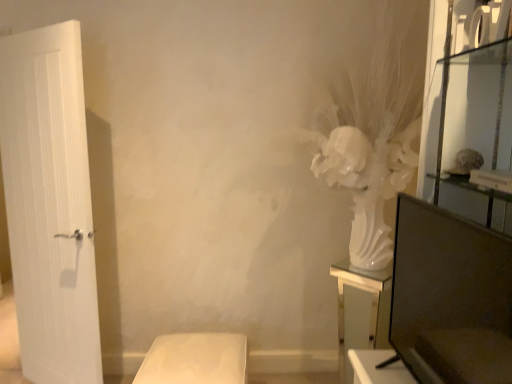
Question: Is white matte stool at lower center, the second furniture positioned from the right, in front of or behind white glossy vase at right, which is counted as the 2th furniture, starting from the left, in the image?

Choices:
 (A) front
 (B) behind

Answer: (A)

Question: From a real-world perspective, is white matte stool at lower center, the second furniture positioned from the right, physically located above or below white glossy vase at right, which is counted as the 2th furniture, starting from the left?

Choices:
 (A) below
 (B) above

Answer: (A)

Question: Is point [183, 350] closer or farther from the camera than point [368, 314]?

Choices:
 (A) farther
 (B) closer

Answer: (B)

Question: From the image's perspective, is white glossy vase at right, which is counted as the 2th furniture, starting from the left, above or below white matte stool at lower center, the 1th furniture in the left-to-right sequence?

Choices:
 (A) below
 (B) above

Answer: (B)

Question: Would you say white glossy vase at right, the first furniture in the right-to-left sequence, is to the left or to the right of white matte stool at lower center, the second furniture positioned from the right, in the picture?

Choices:
 (A) left
 (B) right

Answer: (B)

Question: Considering the positions of white glossy vase at right, the first furniture in the right-to-left sequence, and white matte stool at lower center, the second furniture positioned from the right, in the image, is white glossy vase at right, the first furniture in the right-to-left sequence, wider or thinner than white matte stool at lower center, the second furniture positioned from the right,?

Choices:
 (A) thin
 (B) wide

Answer: (A)

Question: Considering the positions of point (367, 279) and point (156, 357), is point (367, 279) closer or farther from the camera than point (156, 357)?

Choices:
 (A) farther
 (B) closer

Answer: (A)